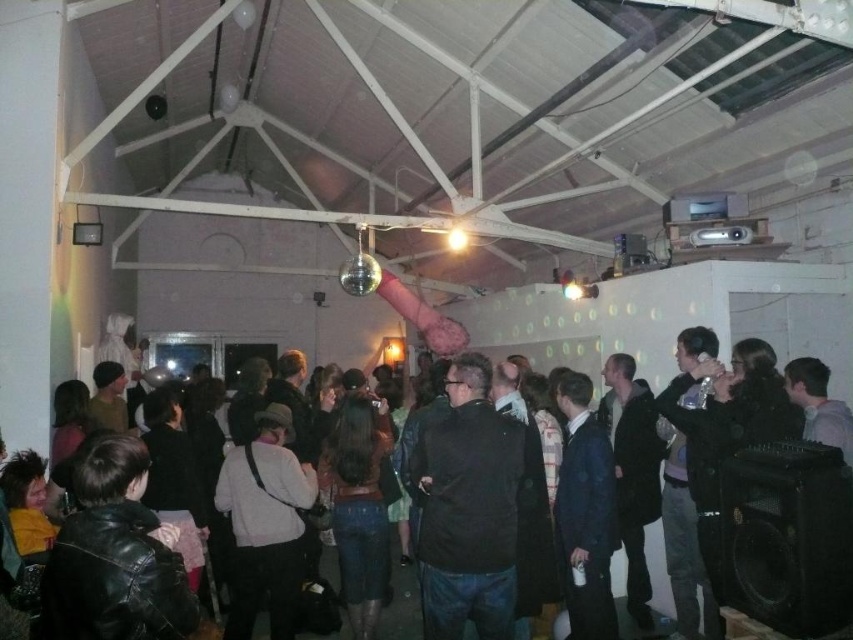
Who is more distant from viewer, (459, 364) or (822, 506)?

The point (459, 364) is behind.

Looking at this image, is black leather jacket at center thinner than black matte speaker at lower right?

No.

This screenshot has width=853, height=640. Find the location of `black leather jacket at center`. black leather jacket at center is located at coordinates (468, 508).

Who is more distant from viewer, (796, 488) or (329, 637)?

The point (329, 637) is more distant.

Can you confirm if black matte speaker at lower right is thinner than leather jacket at center?

No, black matte speaker at lower right is not thinner than leather jacket at center.

You are a GUI agent. You are given a task and a screenshot of the screen. Output one action in this format:
    pyautogui.click(x=<x>, y=<y>)
    Task: Click on the black matte speaker at lower right
    
    Given the screenshot: What is the action you would take?
    pyautogui.click(x=787, y=536)

Based on the photo, between black leather jacket at center and leather jacket at center, which one has less height?

With less height is leather jacket at center.

Who is more distant from viewer, (x=483, y=540) or (x=341, y=636)?

The point (x=341, y=636) is behind.

Is point (474, 554) behind point (398, 580)?

No, (474, 554) is in front of (398, 580).

At what (x,y) coordinates should I click in order to perform the action: click on black leather jacket at center. Please return your answer as a coordinate pair (x, y). The image size is (853, 640). Looking at the image, I should click on (468, 508).